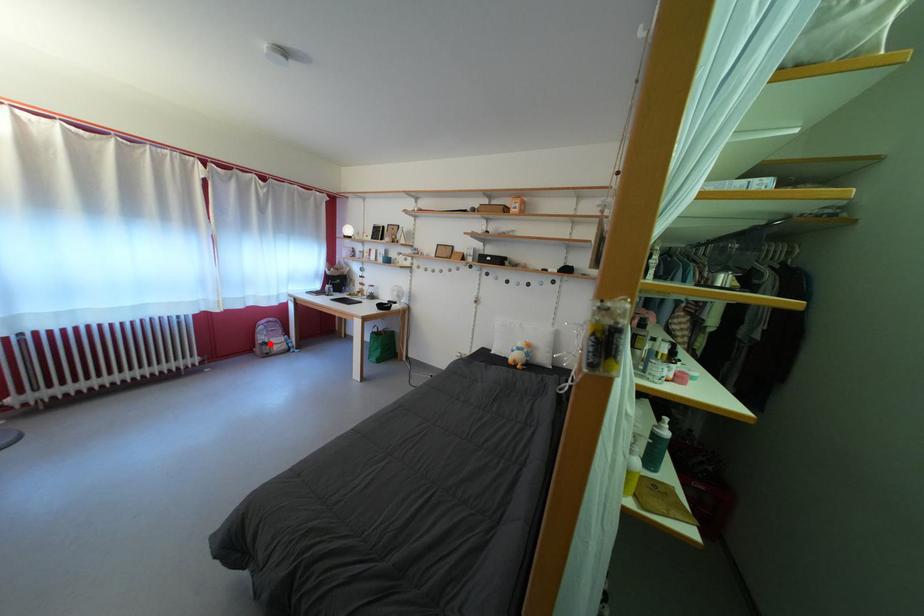
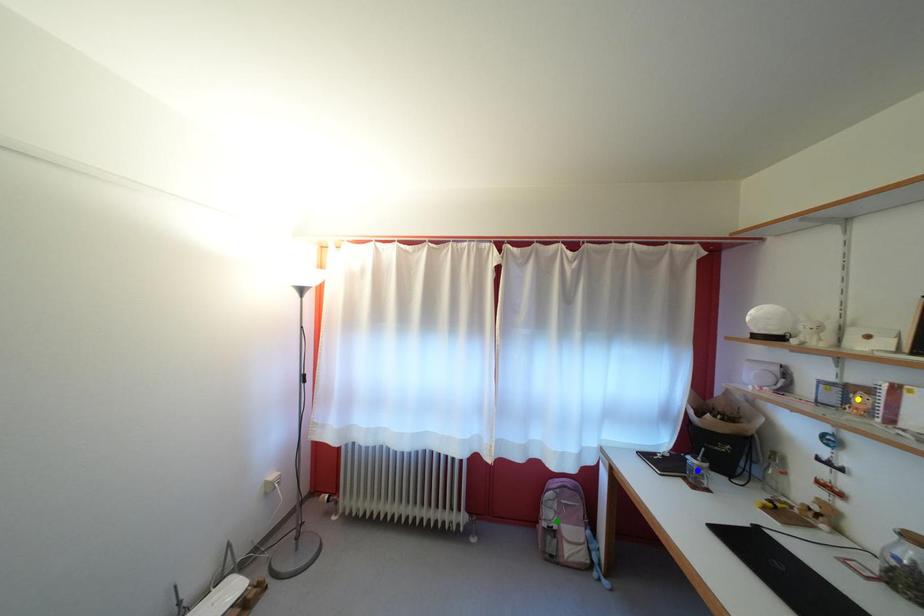
Question: I am providing you with two images of the same scene from different viewpoints. A red point is marked on the first image. You are given multiple points on the second image. Which point in image 2 is actually the same real-world point as the red point in image 1?

Choices:
 (A) green point
 (B) yellow point
 (C) blue point

Answer: (A)